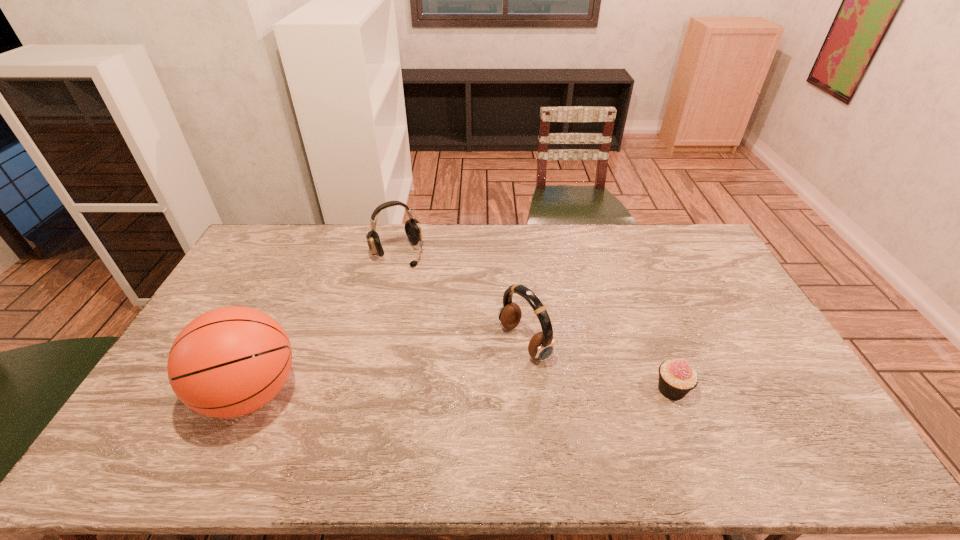
The height and width of the screenshot is (540, 960). In order to click on free location that satisfies the following two spatial constraints: 1. on the front side of the shortest object; 2. on the right side of the farthest object in this screenshot , I will do `click(366, 389)`.